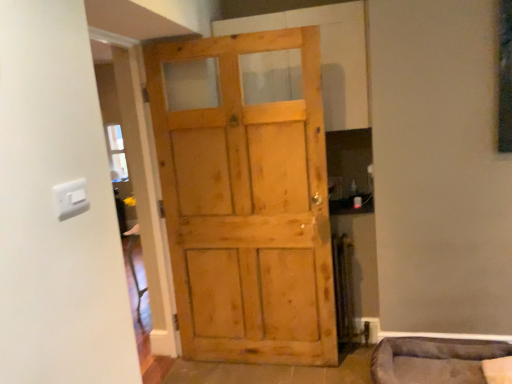
Question: Are light brown wooden door at center and velvet grey pet bed at lower right beside each other?

Choices:
 (A) yes
 (B) no

Answer: (B)

Question: Is light brown wooden door at center positioned beyond the bounds of velvet grey pet bed at lower right?

Choices:
 (A) no
 (B) yes

Answer: (B)

Question: Is light brown wooden door at center positioned with its back to velvet grey pet bed at lower right?

Choices:
 (A) yes
 (B) no

Answer: (B)

Question: Does light brown wooden door at center have a greater height compared to velvet grey pet bed at lower right?

Choices:
 (A) yes
 (B) no

Answer: (A)

Question: Is light brown wooden door at center not near velvet grey pet bed at lower right?

Choices:
 (A) yes
 (B) no

Answer: (B)

Question: From a real-world perspective, is light brown wooden door at center on velvet grey pet bed at lower right?

Choices:
 (A) yes
 (B) no

Answer: (A)

Question: From the image's perspective, is light brown wooden door at center beneath white plastic light switch at upper left?

Choices:
 (A) no
 (B) yes

Answer: (B)

Question: Are light brown wooden door at center and white plastic light switch at upper left making contact?

Choices:
 (A) no
 (B) yes

Answer: (A)

Question: Can you confirm if light brown wooden door at center is wider than white plastic light switch at upper left?

Choices:
 (A) yes
 (B) no

Answer: (A)

Question: Is white plastic light switch at upper left surrounded by light brown wooden door at center?

Choices:
 (A) no
 (B) yes

Answer: (A)

Question: From a real-world perspective, does light brown wooden door at center stand above white plastic light switch at upper left?

Choices:
 (A) no
 (B) yes

Answer: (A)

Question: Can you confirm if light brown wooden door at center is bigger than white plastic light switch at upper left?

Choices:
 (A) no
 (B) yes

Answer: (B)

Question: Is velvet grey pet bed at lower right beside white plastic light switch at upper left?

Choices:
 (A) no
 (B) yes

Answer: (A)